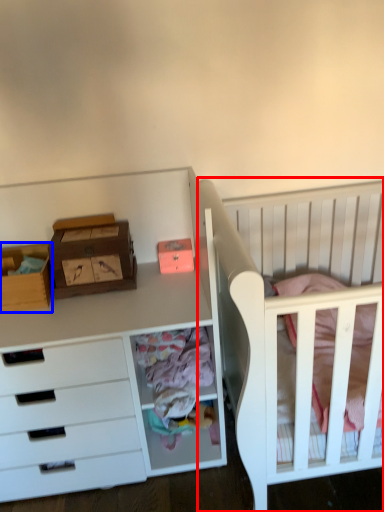
Question: Among these objects, which one is nearest to the camera, infant bed (highlighted by a red box) or storage box (highlighted by a blue box)?

Choices:
 (A) infant bed
 (B) storage box

Answer: (A)